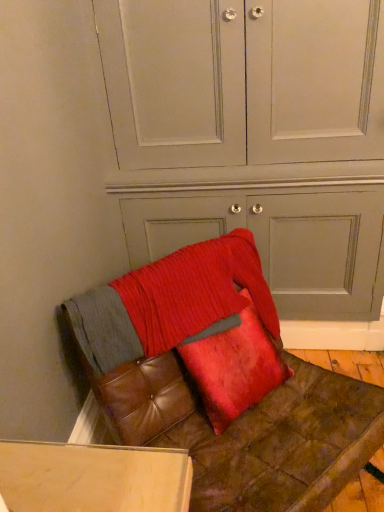
Question: Is point (246, 354) positioned closer to the camera than point (342, 479)?

Choices:
 (A) farther
 (B) closer

Answer: (A)

Question: In terms of size, does velvet red pillow at center appear bigger or smaller than leather cushion at lower right?

Choices:
 (A) small
 (B) big

Answer: (A)

Question: Which of these objects is positioned farthest from the matte gray dresser at center?

Choices:
 (A) leather cushion at lower right
 (B) velvet red pillow at center

Answer: (A)

Question: Estimate the real-world distances between objects in this image. Which object is farther from the leather cushion at lower right?

Choices:
 (A) matte gray dresser at center
 (B) velvet red pillow at center

Answer: (A)